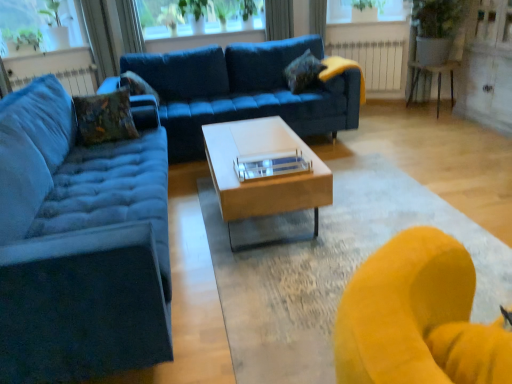
Measure the distance between velvet textured pillow at upper left, which is the second pillow from front to back, and camera.

The distance of velvet textured pillow at upper left, which is the second pillow from front to back, from camera is 3.33 meters.

This screenshot has height=384, width=512. What do you see at coordinates (137, 85) in the screenshot?
I see `velvet textured pillow at upper left, which is the second pillow from front to back` at bounding box center [137, 85].

What is the approximate height of blue fabric curtain at upper center?

It is 19.30 inches.

The height and width of the screenshot is (384, 512). Describe the element at coordinates (79, 245) in the screenshot. I see `velvet blue couch at left, which is counted as the 2th studio couch, starting from the back` at that location.

Where is `velvet blue couch at center, arranged as the 1th studio couch when viewed from the back`? velvet blue couch at center, arranged as the 1th studio couch when viewed from the back is located at coordinates (242, 91).

Considering the relative sizes of blue fabric curtain at upper center and clear glass window screen at upper center, which ranks as the 1th window screen in right-to-left order, in the image provided, is blue fabric curtain at upper center shorter than clear glass window screen at upper center, which ranks as the 1th window screen in right-to-left order,?

In fact, blue fabric curtain at upper center may be taller than clear glass window screen at upper center, which ranks as the 1th window screen in right-to-left order.

Which is closer, (286, 34) or (395, 8)?

Point (286, 34) is positioned farther from the camera compared to point (395, 8).

From the image's perspective, which one is positioned higher, blue fabric curtain at upper center or clear glass window screen at upper center, which ranks as the 1th window screen in right-to-left order?

clear glass window screen at upper center, which ranks as the 1th window screen in right-to-left order, appears higher in the image.

Between blue fabric curtain at upper center and clear glass window screen at upper center, the second window screen viewed from the left, which one is positioned behind?

Positioned behind is blue fabric curtain at upper center.

Does velvet blue couch at left, the 1th studio couch from the front, touch clear glass window screen at upper center, which ranks as the 1th window screen in right-to-left order?

No, velvet blue couch at left, the 1th studio couch from the front, is not making contact with clear glass window screen at upper center, which ranks as the 1th window screen in right-to-left order.

How different are the orientations of velvet blue couch at left, which is counted as the 2th studio couch, starting from the back, and clear glass window screen at upper center, the second window screen viewed from the left, in degrees?

The angular difference between velvet blue couch at left, which is counted as the 2th studio couch, starting from the back, and clear glass window screen at upper center, the second window screen viewed from the left, is 120 degrees.

Is velvet blue couch at left, the 1th studio couch from the front, to the left of clear glass window screen at upper center, the second window screen viewed from the left, from the viewer's perspective?

Indeed, velvet blue couch at left, the 1th studio couch from the front, is positioned on the left side of clear glass window screen at upper center, the second window screen viewed from the left.

Considering the positions of points (151, 214) and (401, 5), is point (151, 214) farther from camera compared to point (401, 5)?

No, it is not.

From the picture: How much distance is there between white metallic radiator at center, which is the first radiator in right-to-left order, and white glossy coffee table at center?

A distance of 9.96 feet exists between white metallic radiator at center, which is the first radiator in right-to-left order, and white glossy coffee table at center.

What's the angular difference between white metallic radiator at center, which is counted as the second radiator, starting from the front, and white glossy coffee table at center's facing directions?

The angle between the facing direction of white metallic radiator at center, which is counted as the second radiator, starting from the front, and the facing direction of white glossy coffee table at center is 121 degrees.

In the image, is white metallic radiator at center, which is counted as the second radiator, starting from the front, positioned in front of or behind white glossy coffee table at center?

In the image, white metallic radiator at center, which is counted as the second radiator, starting from the front, appears behind white glossy coffee table at center.

Does point (330, 53) come in front of point (237, 144)?

That is False.

Measure the distance between white metallic radiator at center, which is the first radiator in right-to-left order, and transparent glass window screen at upper left, marked as the second window screen in a right-to-left arrangement.

They are 11.40 feet apart.

Is white metallic radiator at center, which is counted as the second radiator, starting from the front, in front of transparent glass window screen at upper left, which is the first window screen in left-to-right order?

No, it is not.

Considering the sizes of objects white metallic radiator at center, which is counted as the second radiator, starting from the front, and transparent glass window screen at upper left, which is the first window screen in left-to-right order, in the image provided, who is wider, white metallic radiator at center, which is counted as the second radiator, starting from the front, or transparent glass window screen at upper left, which is the first window screen in left-to-right order,?

transparent glass window screen at upper left, which is the first window screen in left-to-right order.

Which is more to the left, white metallic radiator at center, which is counted as the second radiator, starting from the front, or transparent glass window screen at upper left, which is the first window screen in left-to-right order?

Positioned to the left is transparent glass window screen at upper left, which is the first window screen in left-to-right order.

Considering the positions of objects metallic silver swivel chair at right and velvet blue couch at left, the 1th studio couch from the front, in the image provided, who is more to the left, metallic silver swivel chair at right or velvet blue couch at left, the 1th studio couch from the front,?

From the viewer's perspective, velvet blue couch at left, the 1th studio couch from the front, appears more on the left side.

Considering the positions of points (424, 64) and (81, 178), is point (424, 64) farther from camera compared to point (81, 178)?

Yes, point (424, 64) is farther from viewer.

Which object is further away from the camera taking this photo, metallic silver swivel chair at right or velvet blue couch at left, which is counted as the 2th studio couch, starting from the back?

metallic silver swivel chair at right is more distant.

From a real-world perspective, is metallic silver swivel chair at right positioned above or below velvet blue couch at left, which is counted as the 2th studio couch, starting from the back?

Clearly, from a real-world perspective, metallic silver swivel chair at right is below velvet blue couch at left, which is counted as the 2th studio couch, starting from the back.

From the image's perspective, between clear glass window screen at upper center, the second window screen viewed from the left, and white metallic radiator at center, which ranks as the second radiator in left-to-right order, which one is located above?

clear glass window screen at upper center, the second window screen viewed from the left, from the image's perspective.

How many degrees apart are the facing directions of clear glass window screen at upper center, which ranks as the 1th window screen in right-to-left order, and white metallic radiator at center, which appears as the first radiator when viewed from the back?

There is a 1.25-degree angle between the facing directions of clear glass window screen at upper center, which ranks as the 1th window screen in right-to-left order, and white metallic radiator at center, which appears as the first radiator when viewed from the back.

Which of these two, clear glass window screen at upper center, which ranks as the 1th window screen in right-to-left order, or white metallic radiator at center, which appears as the first radiator when viewed from the back, is bigger?

With larger size is clear glass window screen at upper center, which ranks as the 1th window screen in right-to-left order.

From a real-world perspective, does clear glass window screen at upper center, the second window screen viewed from the left, sit lower than white metallic radiator at center, which ranks as the second radiator in left-to-right order?

Incorrect, from a real-world perspective, clear glass window screen at upper center, the second window screen viewed from the left, is higher than white metallic radiator at center, which ranks as the second radiator in left-to-right order.

Is velvet blue couch at left, the 1th studio couch from the front, inside or outside of white metallic radiator at center, which appears as the first radiator when viewed from the back?

velvet blue couch at left, the 1th studio couch from the front, cannot be found inside white metallic radiator at center, which appears as the first radiator when viewed from the back.

Looking at the image, does velvet blue couch at left, the 1th studio couch from the front, seem bigger or smaller compared to white metallic radiator at center, which is counted as the second radiator, starting from the front?

Considering their sizes, velvet blue couch at left, the 1th studio couch from the front, takes up more space than white metallic radiator at center, which is counted as the second radiator, starting from the front.

From a real-world perspective, who is located higher, velvet blue couch at left, the 1th studio couch from the front, or white metallic radiator at center, which is the first radiator in right-to-left order?

velvet blue couch at left, the 1th studio couch from the front, is physically above.

Does point (89, 239) appear closer or farther from the camera than point (335, 52)?

Point (89, 239).

Which window screen is the 1st one when counting from the front of the blue fabric curtain at upper center? Please provide its 2D coordinates.

[(365, 12)]

From the image's perspective, which studio couch is the 2nd one below the clear glass window screen at upper center, the second window screen viewed from the left? Please provide its 2D coordinates.

[(79, 245)]

When comparing their distances from green leafy plant at upper left, does blue fabric curtain at upper center or white metallic radiator at center, which ranks as the second radiator in left-to-right order, seem further?

Based on the image, white metallic radiator at center, which ranks as the second radiator in left-to-right order, appears to be further to green leafy plant at upper left.

From the image, which object appears to be farther from white glossy coffee table at center, textured velvet pillow at left, the 3th pillow viewed from the back, or green leafy plant at upper left?

green leafy plant at upper left is positioned further to the anchor white glossy coffee table at center.

Based on their spatial positions, is velvet textured pillow at upper left, the second pillow viewed from the back, or white metallic radiator at upper left, positioned as the first radiator in left-to-right order, closer to velvet blue couch at left, the 1th studio couch from the front?

The object closer to velvet blue couch at left, the 1th studio couch from the front, is velvet textured pillow at upper left, the second pillow viewed from the back.

Considering their positions, is white metallic radiator at upper left, the 2th radiator in the back-to-front sequence, positioned closer to velvet textured pillow at upper center, the 1th pillow from the right, than velvet textured pillow at upper left, the second pillow when ordered from left to right?

velvet textured pillow at upper left, the second pillow when ordered from left to right, lies closer to velvet textured pillow at upper center, the 1th pillow from the right, than the other object.

Estimate the real-world distances between objects in this image. Which object is further from metallic silver swivel chair at right, white metallic radiator at upper left, the 2th radiator in the back-to-front sequence, or white glossy coffee table at center?

Based on the image, white metallic radiator at upper left, the 2th radiator in the back-to-front sequence, appears to be further to metallic silver swivel chair at right.

Considering their positions, is velvet blue couch at left, which is counted as the 2th studio couch, starting from the back, positioned further to white metallic radiator at upper left, the second radiator positioned from the right, than white metallic radiator at center, which appears as the first radiator when viewed from the back?

white metallic radiator at center, which appears as the first radiator when viewed from the back, is positioned further to the anchor white metallic radiator at upper left, the second radiator positioned from the right.

From the image, which object appears to be nearer to textured velvet pillow at left, the 3th pillow viewed from the back, transparent glass window screen at upper left, marked as the second window screen in a right-to-left arrangement, or white metallic radiator at upper left, the 2th radiator in the back-to-front sequence?

Based on the image, white metallic radiator at upper left, the 2th radiator in the back-to-front sequence, appears to be nearer to textured velvet pillow at left, the 3th pillow viewed from the back.

Considering their positions, is white glossy coffee table at center positioned further to velvet blue couch at center, the 2th studio couch when ordered from front to back, than transparent glass window screen at upper left, which is the first window screen in left-to-right order?

transparent glass window screen at upper left, which is the first window screen in left-to-right order.

This screenshot has height=384, width=512. Find the location of `coffee table between white metallic radiator at upper left, positioned as the first radiator in left-to-right order, and white metallic radiator at center, which ranks as the second radiator in left-to-right order`. coffee table between white metallic radiator at upper left, positioned as the first radiator in left-to-right order, and white metallic radiator at center, which ranks as the second radiator in left-to-right order is located at coordinates (264, 173).

Identify the location of window screen situated between green leafy plant at upper left and clear glass window screen at upper center, the second window screen viewed from the left, from left to right. (28, 19).

Image resolution: width=512 pixels, height=384 pixels. In order to click on pillow located between white glossy coffee table at center and velvet textured pillow at upper left, which is counted as the 2th pillow, starting from the right, in the depth direction in this screenshot , I will do `click(104, 117)`.

Locate an element on the screen. coffee table between textured velvet pillow at left, which is the 1th pillow in left-to-right order, and metallic silver swivel chair at right, in the horizontal direction is located at coordinates (x=264, y=173).